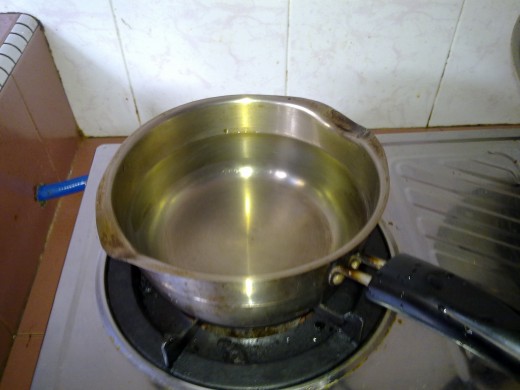
This screenshot has width=520, height=390. I want to click on tiles, so click(250, 25), click(483, 45), click(358, 57).